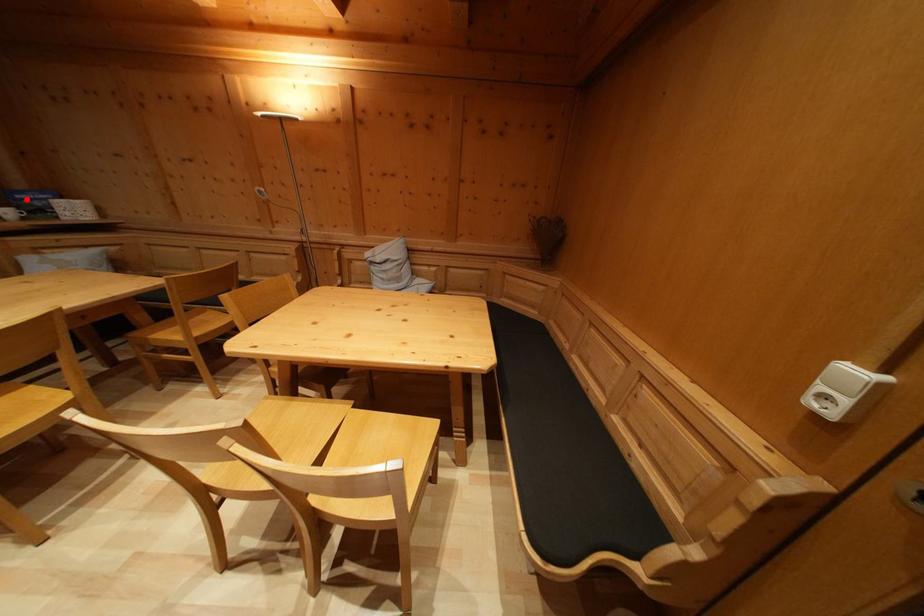
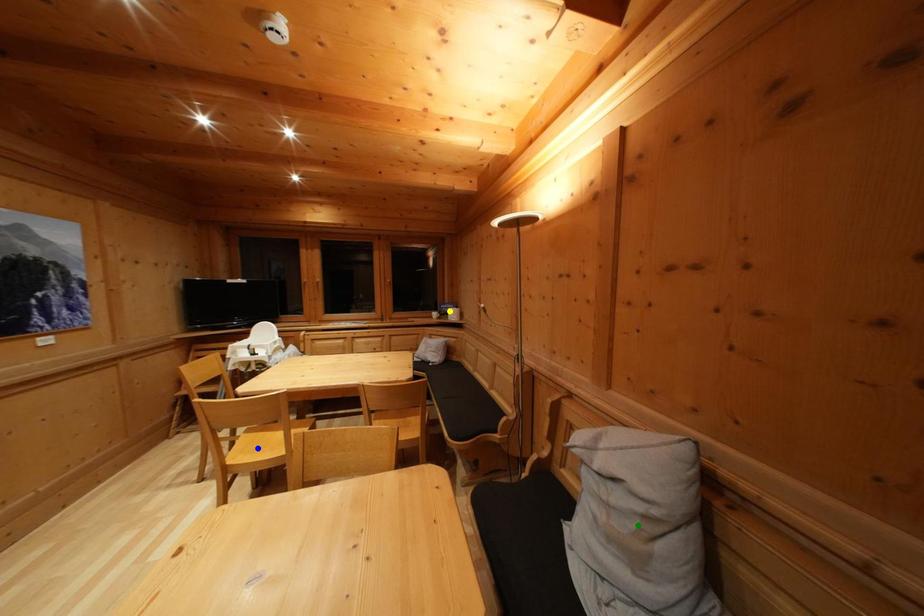
Question: I am providing you with two images of the same scene from different viewpoints. A red point is marked on the first image. You are given multiple points on the second image. Which point in image 2 represents the same 3d spot as the red point in image 1?

Choices:
 (A) blue point
 (B) yellow point
 (C) green point

Answer: (B)